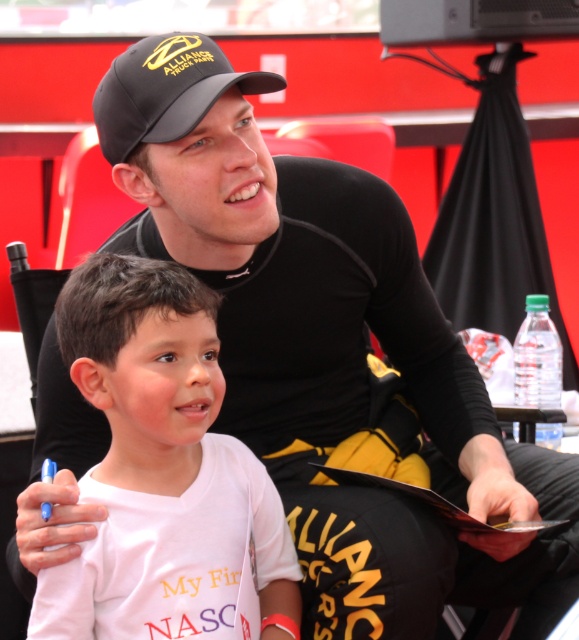
You are a photographer positioned at the center of the scene. You want to capture a closeup shot of the white cotton shirt at lower left and the black matte baseball cap at upper center in the same frame. Given the distance between them, will you need to adjust your camera lens to a wider angle to include both objects in the shot?

The white cotton shirt at lower left is 21.75 inches away from the black matte baseball cap at upper center. To capture both in the same frame, you would need to adjust your camera lens to a wider angle to accommodate the distance between them.

You are at an event and want to take a photo of the white cotton shirt at lower left and the black matte baseball cap at upper center. Which object should you focus on first if you want to capture both in the frame without zooming in or out?

The white cotton shirt at lower left is larger in size than the black matte baseball cap at upper center, so you should focus on the white cotton shirt at lower left first to ensure it fits properly in the frame before adjusting for the smaller cap.